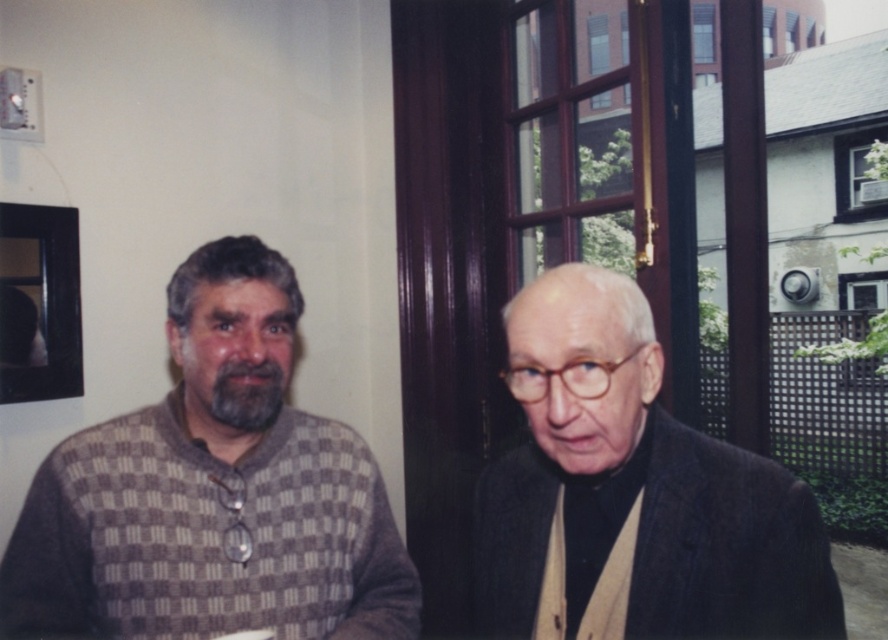
Question: Does checkered sweater at left appear on the right side of dark gray wool suit at right?

Choices:
 (A) no
 (B) yes

Answer: (A)

Question: Is checkered sweater at left to the left of dark gray wool suit at right from the viewer's perspective?

Choices:
 (A) no
 (B) yes

Answer: (B)

Question: Can you confirm if checkered sweater at left is positioned above dark gray wool suit at right?

Choices:
 (A) no
 (B) yes

Answer: (A)

Question: Which of the following is the closest to the observer?

Choices:
 (A) (239, 509)
 (B) (811, 520)

Answer: (B)